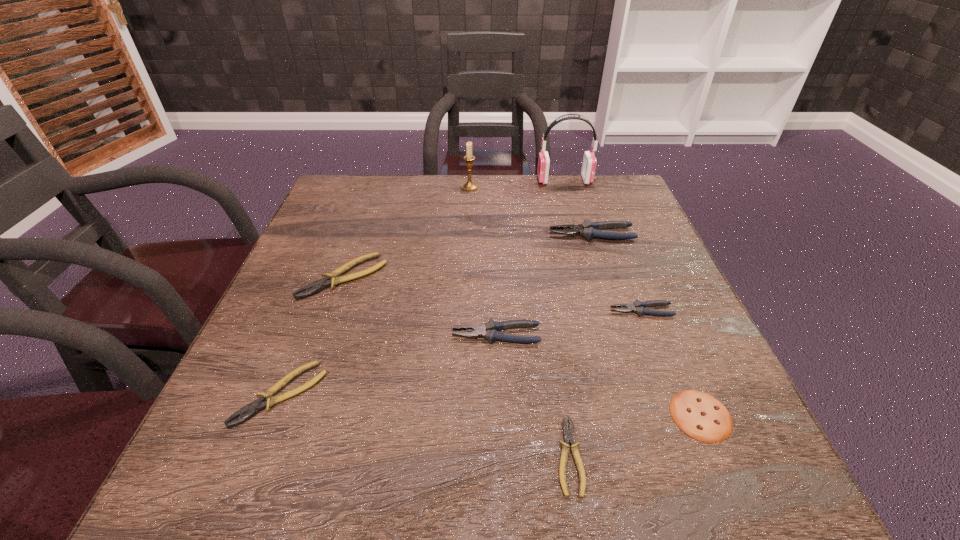
Locate an element on the screen. Image resolution: width=960 pixels, height=540 pixels. gray pliers that is the second nearest to the fourth tallest object is located at coordinates (587, 229).

Identify which gray pliers is located as the second nearest to the smallest yellow pliers. Please provide its 2D coordinates. Your answer should be formatted as a tuple, i.e. [(x, y)], where the tuple contains the x and y coordinates of a point satisfying the conditions above.

[(638, 307)]

You are a GUI agent. You are given a task and a screenshot of the screen. Output one action in this format:
    pyautogui.click(x=<x>, y=<y>)
    Task: Click on the yellow pliers that is the closest to the biggest yellow pliers
    This screenshot has height=540, width=960.
    Given the screenshot: What is the action you would take?
    pyautogui.click(x=248, y=411)

This screenshot has height=540, width=960. Identify the location of yellow pliers that is the second closest to the shortest object. (332, 279).

Where is `vacant space that satisfies the following two spatial constraints: 1. at the gripping part of the second nearest gray pliers; 2. on the back side of the cookie`? vacant space that satisfies the following two spatial constraints: 1. at the gripping part of the second nearest gray pliers; 2. on the back side of the cookie is located at coordinates (682, 415).

I want to click on vacant space that satisfies the following two spatial constraints: 1. at the gripping part of the third tallest object; 2. on the left side of the cookie, so click(x=651, y=415).

In order to click on free space that satisfies the following two spatial constraints: 1. on the outer surface of the tallest object; 2. on the front side of the second biggest yellow pliers in this screenshot , I will do pyautogui.click(x=627, y=394).

The image size is (960, 540). Identify the location of vacant space that satisfies the following two spatial constraints: 1. on the outer surface of the earphone; 2. on the back side of the cookie. (633, 415).

This screenshot has width=960, height=540. Identify the location of blank area in the image that satisfies the following two spatial constraints: 1. at the gripping part of the second smallest gray pliers; 2. on the back side of the shortest object. (500, 456).